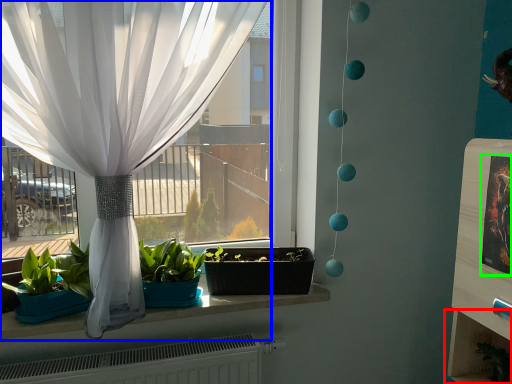
Question: Which object is the closest to the shelf (highlighted by a red box)? Choose among these: curtain (highlighted by a blue box) or picture frame (highlighted by a green box).

Choices:
 (A) curtain
 (B) picture frame

Answer: (B)